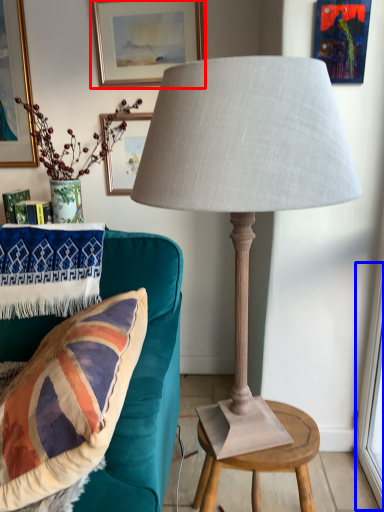
Question: Which object appears farthest to the camera in this image, picture frame (highlighted by a red box) or window screen (highlighted by a blue box)?

Choices:
 (A) picture frame
 (B) window screen

Answer: (A)